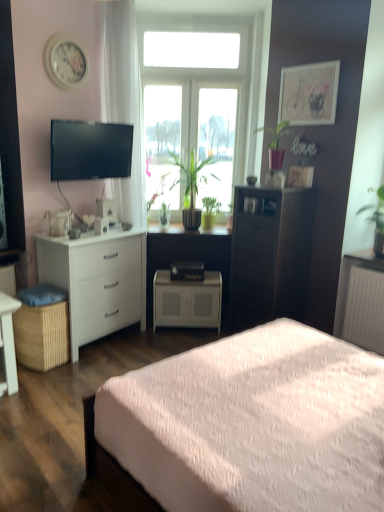
This screenshot has height=512, width=384. Identify the location of vacant area located to the right-hand side of white glossy desk at lower left. (37, 381).